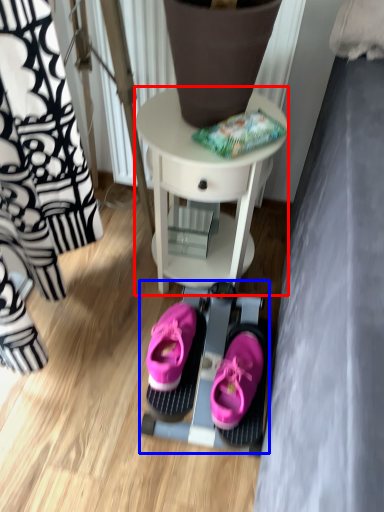
Question: Which point is closer to the camera, table (highlighted by a red box) or bunk bed (highlighted by a blue box)?

Choices:
 (A) table
 (B) bunk bed

Answer: (A)